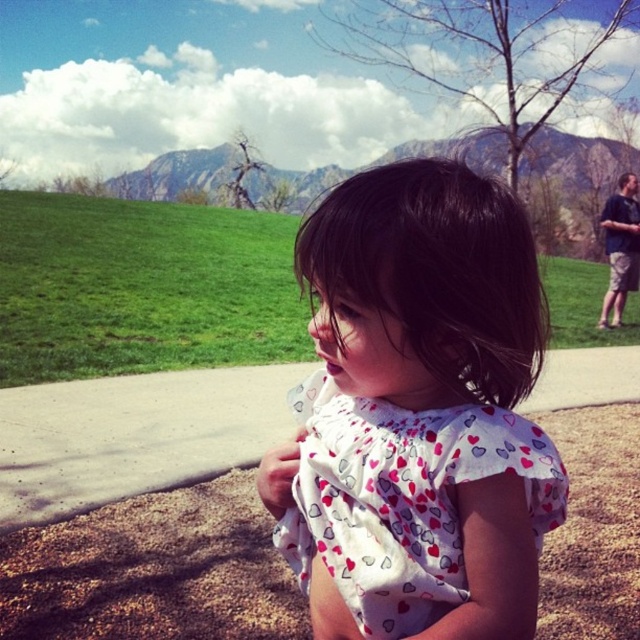
You are standing at the camera position looking at the scene. There are two points marked in the image, point 1 at coordinates point [472,220] and point 2 at coordinates point [561,376]. Which point is closer to you?

Point [472,220] is closer to the camera than point [561,376].